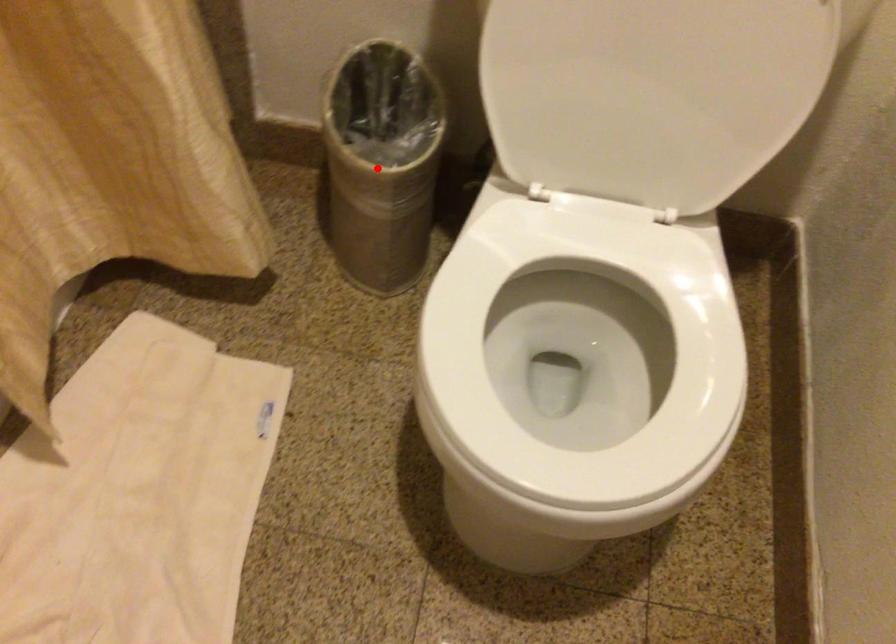
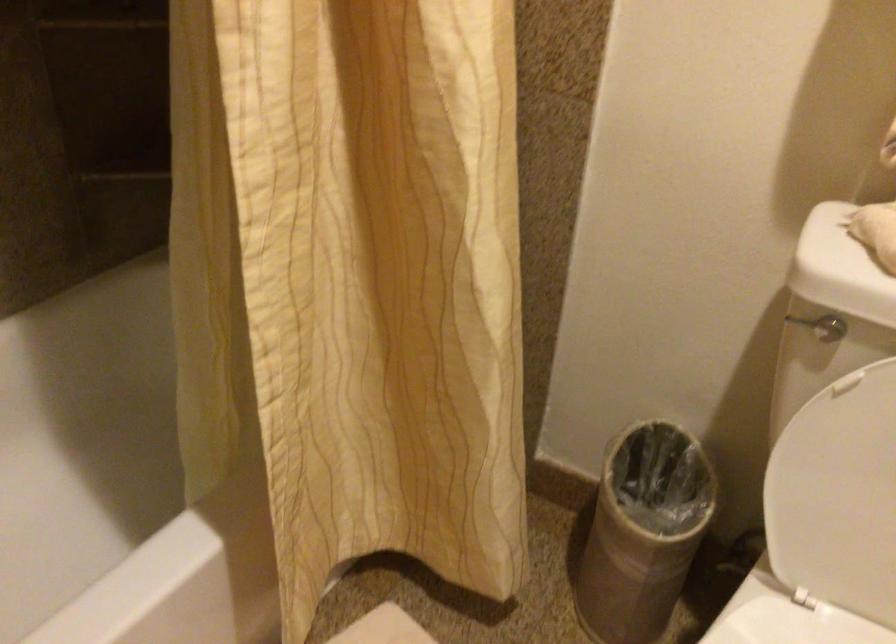
Find the pixel in the second image that matches the highlighted location in the first image.

(643, 532)